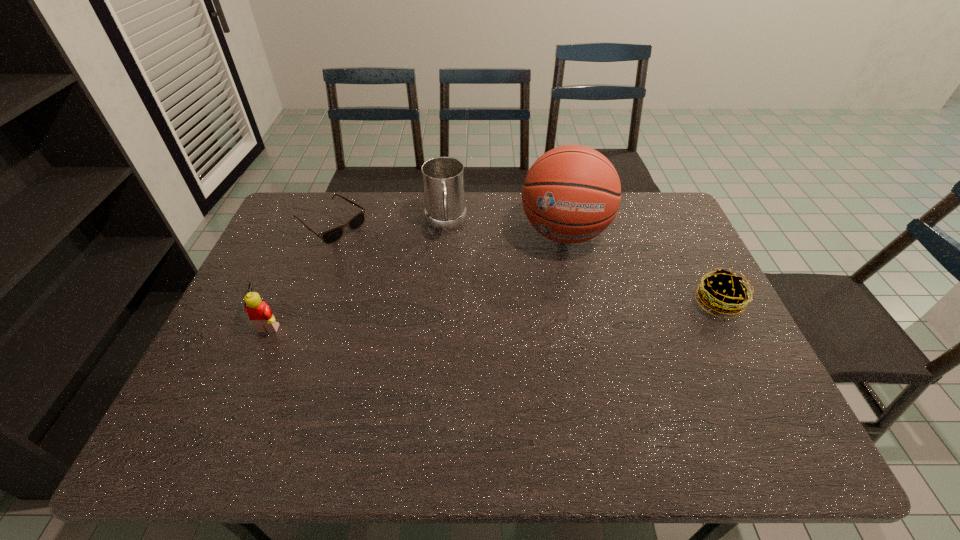
The height and width of the screenshot is (540, 960). In order to click on vacant space on the desktop that is between the Lego and the rightmost object and is positioned on the logo side of the tallest object in this screenshot , I will do `click(557, 310)`.

At what (x,y) coordinates should I click in order to perform the action: click on free space on the desktop that is between the third tallest object and the patty and is positioned on the side of the third object from left to right with the handle. Please return your answer as a coordinate pair (x, y). Image resolution: width=960 pixels, height=540 pixels. Looking at the image, I should click on (450, 314).

The image size is (960, 540). I want to click on free space on the desktop that is between the third tallest object and the second shortest object and is positioned on the lenses of the sunglasses, so click(x=461, y=314).